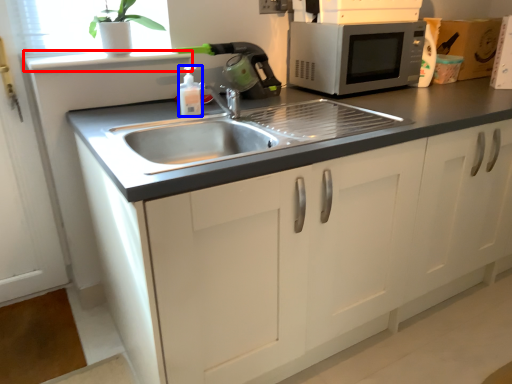
Question: Which object appears farthest to the camera in this image, window sill (highlighted by a red box) or bottle (highlighted by a blue box)?

Choices:
 (A) window sill
 (B) bottle

Answer: (A)